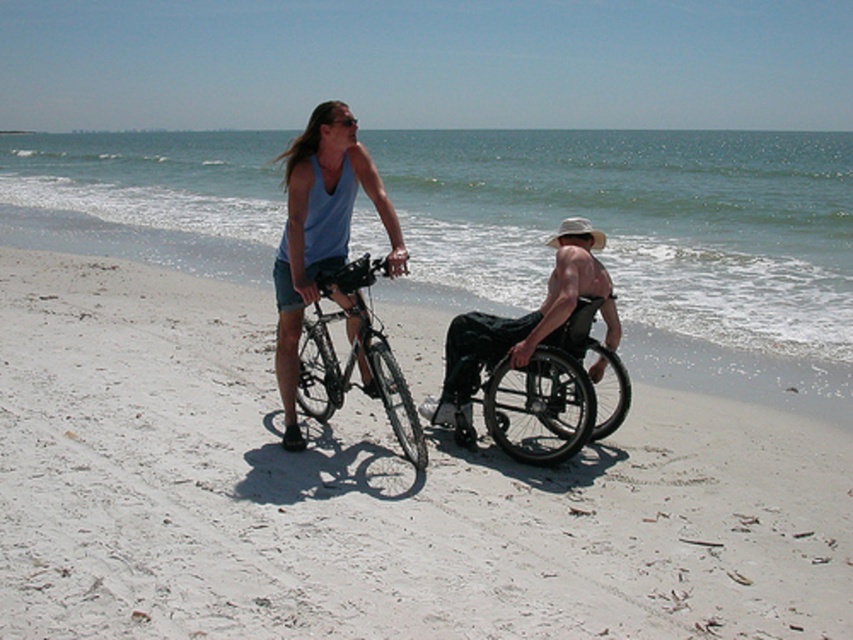
Does white sand at lower center have a smaller size compared to black matte wheelchair at center?

No.

Can you confirm if white sand at lower center is bigger than black matte wheelchair at center?

Indeed, white sand at lower center has a larger size compared to black matte wheelchair at center.

Describe the element at coordinates (729, 336) in the screenshot. I see `white sand at lower center` at that location.

At what (x,y) coordinates should I click in order to perform the action: click on white sand at lower center. Please return your answer as a coordinate pair (x, y). This screenshot has width=853, height=640. Looking at the image, I should click on (729, 336).

Based on the photo, which is above, white sand at lower center or matte blue tank top at center?

white sand at lower center is higher up.

Can you confirm if white sand at lower center is positioned below matte blue tank top at center?

Incorrect, white sand at lower center is not positioned below matte blue tank top at center.

Is point (619, 284) closer to viewer compared to point (317, 198)?

No, it is not.

At what (x,y) coordinates should I click in order to perform the action: click on white sand at lower center. Please return your answer as a coordinate pair (x, y). Looking at the image, I should click on (729, 336).

Between white sand at lower center and silver metallic bicycle at center, which one appears on the right side from the viewer's perspective?

Positioned to the right is silver metallic bicycle at center.

Can you confirm if white sand at lower center is positioned to the right of silver metallic bicycle at center?

Incorrect, white sand at lower center is not on the right side of silver metallic bicycle at center.

Between point (463, 291) and point (326, 360), which one is positioned behind?

Point (463, 291)

Image resolution: width=853 pixels, height=640 pixels. I want to click on white sand at lower center, so click(x=729, y=336).